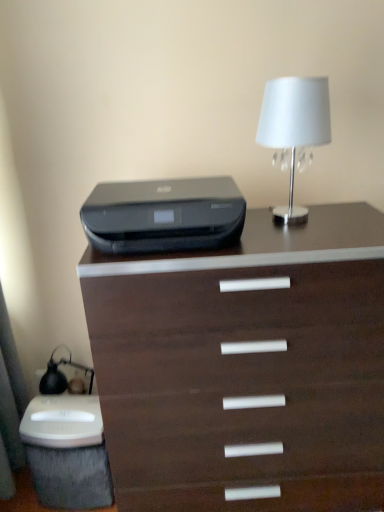
Question: From the image's perspective, is white fabric lampshade at upper right beneath black plastic printer at center?

Choices:
 (A) no
 (B) yes

Answer: (A)

Question: Considering the relative sizes of white fabric lampshade at upper right and black plastic printer at center in the image provided, is white fabric lampshade at upper right thinner than black plastic printer at center?

Choices:
 (A) no
 (B) yes

Answer: (B)

Question: Is black plastic printer at center a part of white fabric lampshade at upper right?

Choices:
 (A) no
 (B) yes

Answer: (A)

Question: From a real-world perspective, does white fabric lampshade at upper right stand above black plastic printer at center?

Choices:
 (A) yes
 (B) no

Answer: (A)

Question: From a real-world perspective, does white fabric lampshade at upper right sit lower than black plastic printer at center?

Choices:
 (A) no
 (B) yes

Answer: (A)

Question: Would you say black plastic printer at center is inside or outside dark wood chest of drawers at center?

Choices:
 (A) inside
 (B) outside

Answer: (B)

Question: Considering the relative positions of black plastic printer at center and dark wood chest of drawers at center in the image provided, is black plastic printer at center to the left or to the right of dark wood chest of drawers at center?

Choices:
 (A) right
 (B) left

Answer: (B)

Question: Considering the positions of black plastic printer at center and dark wood chest of drawers at center in the image, is black plastic printer at center bigger or smaller than dark wood chest of drawers at center?

Choices:
 (A) big
 (B) small

Answer: (B)

Question: In terms of width, does black plastic printer at center look wider or thinner when compared to dark wood chest of drawers at center?

Choices:
 (A) thin
 (B) wide

Answer: (A)

Question: Relative to black plastic printer at center, is dark wood chest of drawers at center in front or behind?

Choices:
 (A) behind
 (B) front

Answer: (B)

Question: In terms of width, does dark wood chest of drawers at center look wider or thinner when compared to black plastic printer at center?

Choices:
 (A) wide
 (B) thin

Answer: (A)

Question: Based on their positions, is dark wood chest of drawers at center located to the left or right of black plastic printer at center?

Choices:
 (A) left
 (B) right

Answer: (B)

Question: From a real-world perspective, is dark wood chest of drawers at center physically located above or below black plastic printer at center?

Choices:
 (A) above
 (B) below

Answer: (B)

Question: In the image, is black plastic printer at center positioned in front of or behind white fabric lampshade at upper right?

Choices:
 (A) behind
 (B) front

Answer: (B)

Question: From a real-world perspective, is black plastic printer at center positioned above or below white fabric lampshade at upper right?

Choices:
 (A) below
 (B) above

Answer: (A)